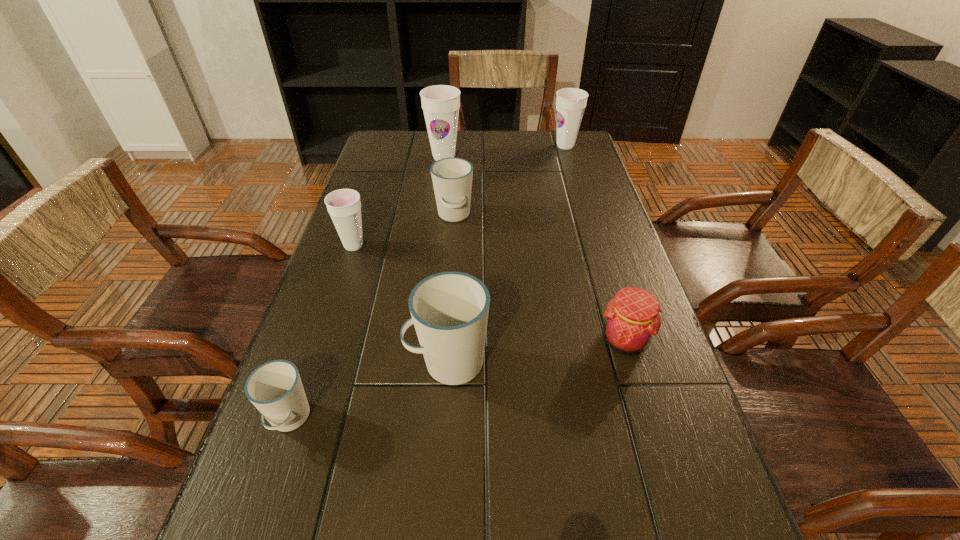
This screenshot has height=540, width=960. In order to click on jam in this screenshot , I will do `click(632, 319)`.

The width and height of the screenshot is (960, 540). I want to click on the nearest cup, so click(275, 388).

The image size is (960, 540). What are the coordinates of `the nearest object` in the screenshot? It's located at (275, 388).

Locate an element on the screen. vacant space located on the back of the tallest object is located at coordinates (446, 139).

The image size is (960, 540). I want to click on free location located on the front of the rightmost purple cup, so click(x=581, y=198).

The height and width of the screenshot is (540, 960). In order to click on free region located 0.110m with a handle on the side of the biggest white cup in this screenshot , I will do `click(350, 363)`.

I want to click on free space located with a handle on the side of the biggest white cup, so click(x=320, y=363).

Locate an element on the screen. Image resolution: width=960 pixels, height=540 pixels. vacant space located with a handle on the side of the biggest white cup is located at coordinates (356, 363).

Where is `vacant area situated with a handle on the side of the second smallest white cup`? This screenshot has height=540, width=960. vacant area situated with a handle on the side of the second smallest white cup is located at coordinates 451,246.

Image resolution: width=960 pixels, height=540 pixels. In order to click on free point located on the front of the smallest purple cup in this screenshot , I will do [x=334, y=305].